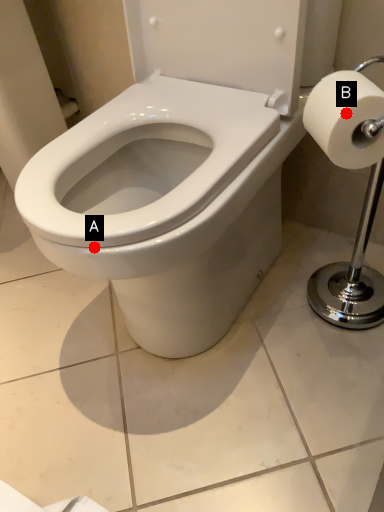
Question: Two points are circled on the image, labeled by A and B beside each circle. Which point is further to the camera?

Choices:
 (A) A is further
 (B) B is further

Answer: (A)